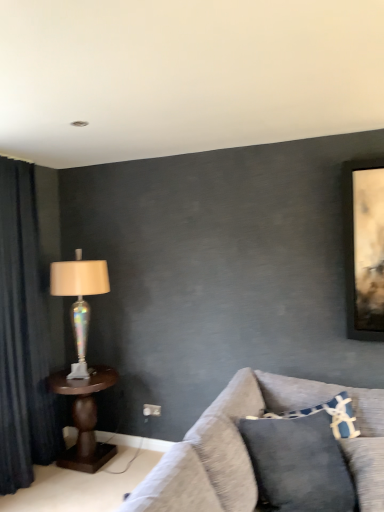
Where is `textured gray couch at lower right`? The image size is (384, 512). textured gray couch at lower right is located at coordinates (247, 451).

Identify the location of brown wooden table at left. 85,418.

Find the location of `textured gray couch at lower right`. textured gray couch at lower right is located at coordinates (247, 451).

Between blue textured pillow at lower right and dark blue fabric curtain at left, which one has smaller width?

blue textured pillow at lower right.

Is blue textured pillow at lower right shorter than dark blue fabric curtain at left?

Yes.

Is blue textured pillow at lower right facing towards dark blue fabric curtain at left?

No.

Could dark blue fabric curtain at left be considered to be inside blue textured pillow at lower right?

No, blue textured pillow at lower right does not contain dark blue fabric curtain at left.

Can you confirm if dark blue fabric curtain at left is smaller than iridescent glass lamp at left?

Incorrect, dark blue fabric curtain at left is not smaller in size than iridescent glass lamp at left.

Would you say dark blue fabric curtain at left is a long distance from iridescent glass lamp at left?

That's not correct — dark blue fabric curtain at left is a little close to iridescent glass lamp at left.

Can you tell me how much dark blue fabric curtain at left and iridescent glass lamp at left differ in facing direction?

89.3 degrees.

From the image's perspective, would you say dark blue fabric curtain at left is positioned over iridescent glass lamp at left?

Incorrect, from the image's perspective, dark blue fabric curtain at left is lower than iridescent glass lamp at left.

How much distance is there between blue textured pillow at lower right and iridescent glass lamp at left?

blue textured pillow at lower right is 5.55 feet away from iridescent glass lamp at left.

Between blue textured pillow at lower right and iridescent glass lamp at left, which one has smaller width?

blue textured pillow at lower right is thinner.

From the image's perspective, does blue textured pillow at lower right appear lower than iridescent glass lamp at left?

Yes, from the image's perspective, blue textured pillow at lower right is beneath iridescent glass lamp at left.

How many degrees apart are the facing directions of blue textured pillow at lower right and iridescent glass lamp at left?

The angular difference between blue textured pillow at lower right and iridescent glass lamp at left is 13.2 degrees.

Is dark blue fabric curtain at left smaller than brown wooden table at left?

No, dark blue fabric curtain at left is not smaller than brown wooden table at left.

Is dark blue fabric curtain at left far from brown wooden table at left?

No, dark blue fabric curtain at left is not far away from brown wooden table at left.

Is dark blue fabric curtain at left closer to camera compared to brown wooden table at left?

Yes, dark blue fabric curtain at left is in front of brown wooden table at left.

Considering the sizes of objects dark blue fabric curtain at left and brown wooden table at left in the image provided, who is thinner, dark blue fabric curtain at left or brown wooden table at left?

dark blue fabric curtain at left is thinner.

Does point (38, 362) lie behind point (244, 387)?

Yes.

Looking at this image, from a real-world perspective, is dark blue fabric curtain at left positioned over textured gray couch at lower right based on gravity?

Yes, from a real-world perspective, dark blue fabric curtain at left is on top of textured gray couch at lower right.

Considering the sizes of objects dark blue fabric curtain at left and textured gray couch at lower right in the image provided, who is shorter, dark blue fabric curtain at left or textured gray couch at lower right?

With less height is textured gray couch at lower right.

Measure the distance from brown wooden table at left to blue textured pillow at lower right.

brown wooden table at left and blue textured pillow at lower right are 1.60 meters apart from each other.

Considering the sizes of objects brown wooden table at left and blue textured pillow at lower right in the image provided, who is thinner, brown wooden table at left or blue textured pillow at lower right?

Thinner between the two is blue textured pillow at lower right.

Is blue textured pillow at lower right completely or partially inside brown wooden table at left?

No, blue textured pillow at lower right is not a part of brown wooden table at left.

Is there a large distance between iridescent glass lamp at left and blue textured pillow at lower right?

Yes, iridescent glass lamp at left and blue textured pillow at lower right are quite far apart.

Is iridescent glass lamp at left spatially inside blue textured pillow at lower right, or outside of it?

iridescent glass lamp at left cannot be found inside blue textured pillow at lower right.

Considering the relative sizes of iridescent glass lamp at left and blue textured pillow at lower right in the image provided, is iridescent glass lamp at left thinner than blue textured pillow at lower right?

In fact, iridescent glass lamp at left might be wider than blue textured pillow at lower right.

This screenshot has height=512, width=384. Find the location of `pillow below the dark blue fabric curtain at left (from a real-world perspective)`. pillow below the dark blue fabric curtain at left (from a real-world perspective) is located at coordinates (328, 414).

The height and width of the screenshot is (512, 384). In order to click on curtain located on the left of iridescent glass lamp at left in this screenshot , I will do `click(23, 338)`.

When comparing their distances from dark blue fabric curtain at left, does brown wooden table at left or blue textured pillow at lower right seem further?

Based on the image, blue textured pillow at lower right appears to be further to dark blue fabric curtain at left.

Looking at the image, which one is located closer to textured gray couch at lower right, dark blue fabric curtain at left or iridescent glass lamp at left?

iridescent glass lamp at left.

Estimate the real-world distances between objects in this image. Which object is closer to textured gray couch at lower right, dark blue fabric curtain at left or brown wooden table at left?

Based on the image, brown wooden table at left appears to be nearer to textured gray couch at lower right.

Based on the photo, from the image, which object appears to be farther from textured gray couch at lower right, dark blue fabric curtain at left or blue textured pillow at lower right?

Based on the image, dark blue fabric curtain at left appears to be further to textured gray couch at lower right.

Considering their positions, is dark blue fabric curtain at left positioned further to blue textured pillow at lower right than textured gray couch at lower right?

dark blue fabric curtain at left lies further to blue textured pillow at lower right than the other object.

Estimate the real-world distances between objects in this image. Which object is closer to blue textured pillow at lower right, brown wooden table at left or iridescent glass lamp at left?

brown wooden table at left.

Based on their spatial positions, is blue textured pillow at lower right or textured gray couch at lower right closer to iridescent glass lamp at left?

textured gray couch at lower right lies closer to iridescent glass lamp at left than the other object.

Considering their positions, is brown wooden table at left positioned further to blue textured pillow at lower right than textured gray couch at lower right?

brown wooden table at left is positioned further to the anchor blue textured pillow at lower right.

Where is `lamp located between dark blue fabric curtain at left and blue textured pillow at lower right in the left-right direction`? The width and height of the screenshot is (384, 512). lamp located between dark blue fabric curtain at left and blue textured pillow at lower right in the left-right direction is located at coordinates (79, 300).

You are a GUI agent. You are given a task and a screenshot of the screen. Output one action in this format:
    pyautogui.click(x=<x>, y=<y>)
    Task: Click on the studio couch between dark blue fabric curtain at left and blue textured pillow at lower right from left to right
    This screenshot has width=384, height=512.
    Given the screenshot: What is the action you would take?
    [x=247, y=451]

Identify the location of curtain that lies between iridescent glass lamp at left and brown wooden table at left from top to bottom. This screenshot has width=384, height=512. (23, 338).

Locate an element on the screen. This screenshot has width=384, height=512. curtain between textured gray couch at lower right and iridescent glass lamp at left along the z-axis is located at coordinates (23, 338).